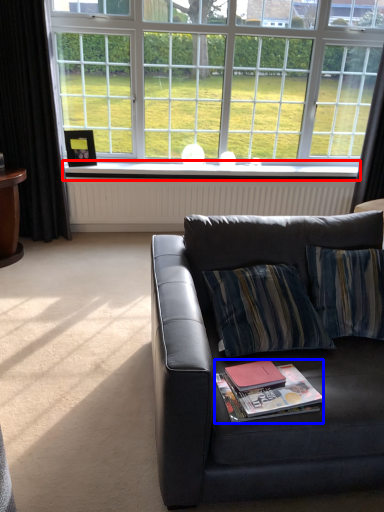
Question: Which of the following is the farthest to the observer, window sill (highlighted by a red box) or magazine (highlighted by a blue box)?

Choices:
 (A) window sill
 (B) magazine

Answer: (A)